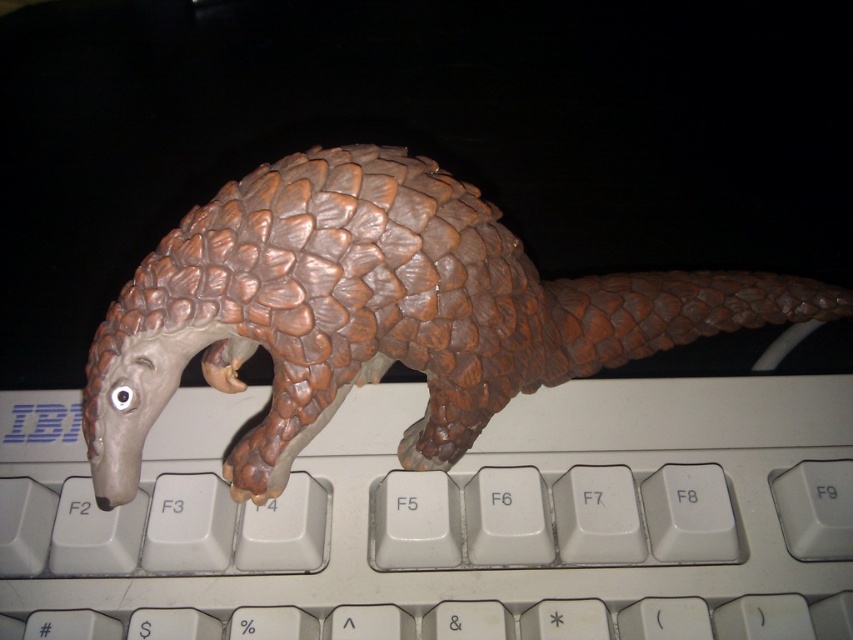
Question: Where is white plastic keyboard at center located in relation to brown scaly pangolin at center in the image?

Choices:
 (A) below
 (B) above

Answer: (A)

Question: Which point is closer to the camera taking this photo?

Choices:
 (A) (347, 442)
 (B) (86, 369)

Answer: (B)

Question: Does white plastic keyboard at center appear on the right side of brown scaly pangolin at center?

Choices:
 (A) no
 (B) yes

Answer: (A)

Question: Does white plastic keyboard at center have a larger size compared to brown scaly pangolin at center?

Choices:
 (A) yes
 (B) no

Answer: (B)